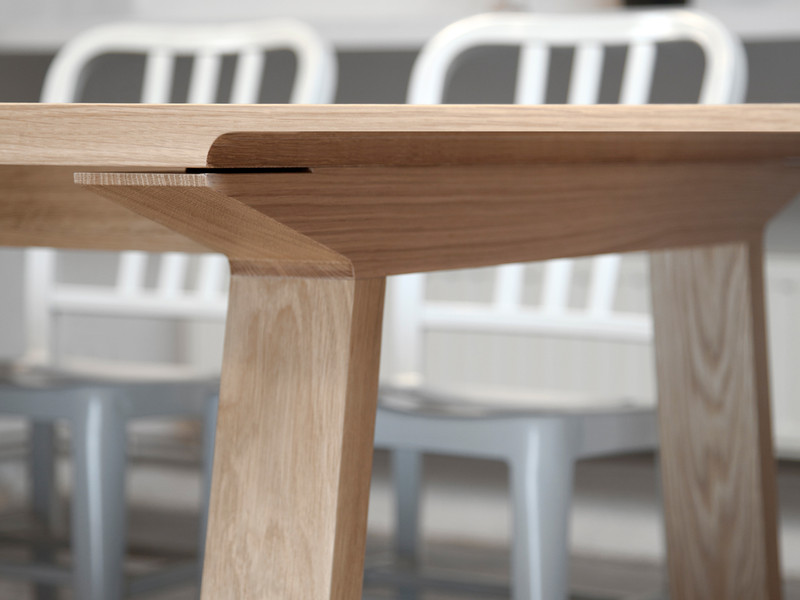
At what (x,y) coordinates should I click in order to perform the action: click on chair back. Please return your answer as a coordinate pair (x, y). The width and height of the screenshot is (800, 600). Looking at the image, I should click on (580, 30), (169, 34).